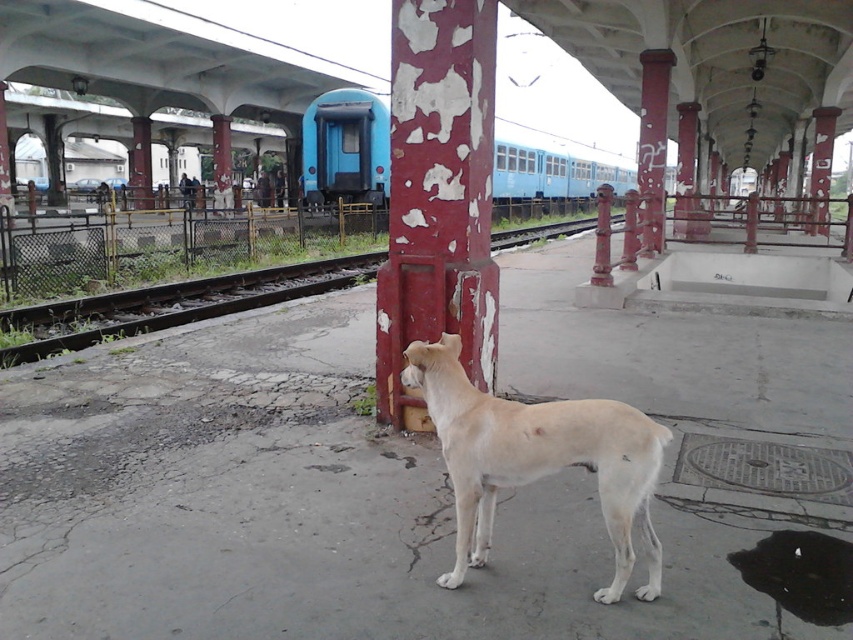
You are a maintenance worker needing to reach the rusty metal pillar at center from the brown gravel train track at lower left. Can you walk directly to it without crossing any obstacles?

The distance between the brown gravel train track at lower left and the rusty metal pillar at center is 7.39 meters. Since there are no obstacles mentioned in the scene description, you can walk directly to the pillar.

Based on the photo, you are a photographer standing on the train station platform. You want to take a photo that includes both the peeling paint column at center and the fur white dog at center. Since you want the column to be a prominent feature in the photo, which object should you position closer to the camera?

The peeling paint column at center is taller than the fur white dog at center. To make the column a prominent feature, position the peeling paint column at center closer to the camera so its height is emphasized in the photo.

You are standing on the train station platform and see the light colored dog on the platform facing left. There is a blue matte train represented by the point at (x=346, y=147). If you want to walk from the dog to the train, which direction should you head?

The blue matte train at center is represented by point (x=346, y=147). To walk from the light colored dog on the platform facing left to the train, you should head towards the center of the platform since the train is located there.